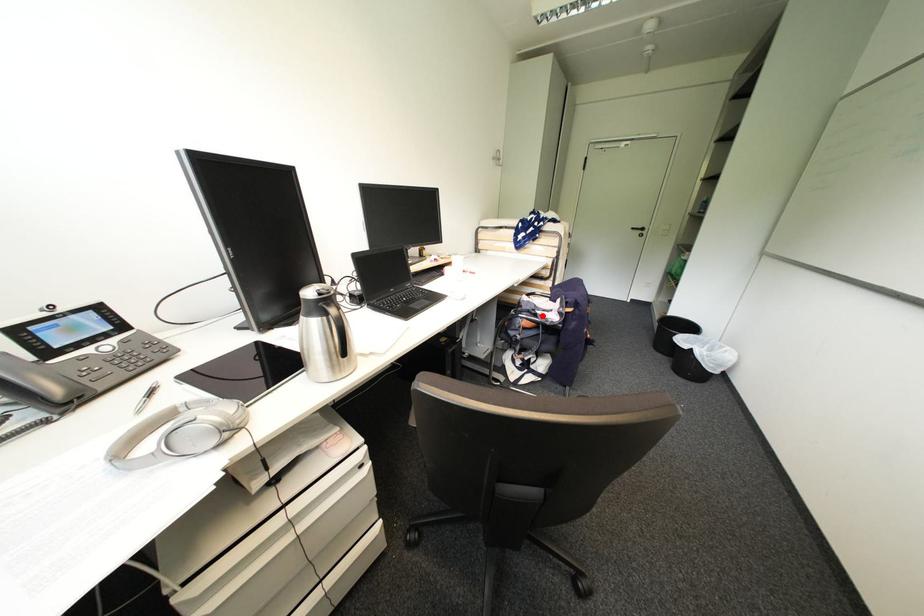
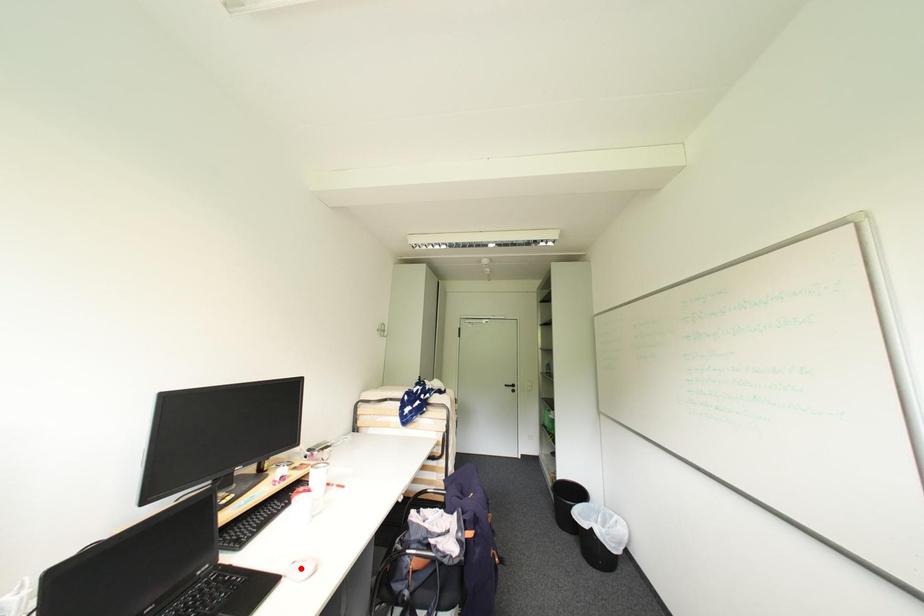
I am providing you with two images of the same scene from different viewpoints. A red point is marked on the first image and another point is marked on the second image. Does the point marked in image1 correspond to the same location as the one in image2?

No